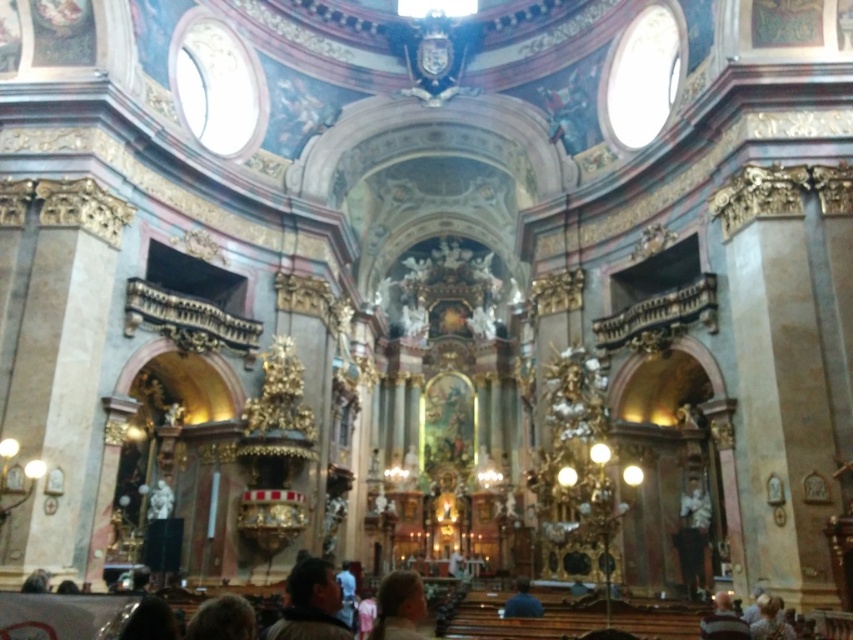
Question: Can you confirm if dark brown leather jacket at center is smaller than striped sweater at lower right?

Choices:
 (A) no
 (B) yes

Answer: (A)

Question: Is dark brown leather jacket at center above striped sweater at lower right?

Choices:
 (A) no
 (B) yes

Answer: (B)

Question: Can you confirm if white statue at right is positioned to the right of striped sweater at lower right?

Choices:
 (A) no
 (B) yes

Answer: (B)

Question: Which point is closer to the camera?

Choices:
 (A) (708, 572)
 (B) (718, 602)

Answer: (B)

Question: Which object appears farthest from the camera in this image?

Choices:
 (A) dark brown leather jacket at center
 (B) blonde hair at lower right
 (C) white statue at right
 (D) light brown hair at lower center

Answer: (C)

Question: Which point is farther from the camera taking this photo?

Choices:
 (A) (763, 616)
 (B) (506, 602)
 (C) (415, 637)
 (D) (695, 547)

Answer: (D)